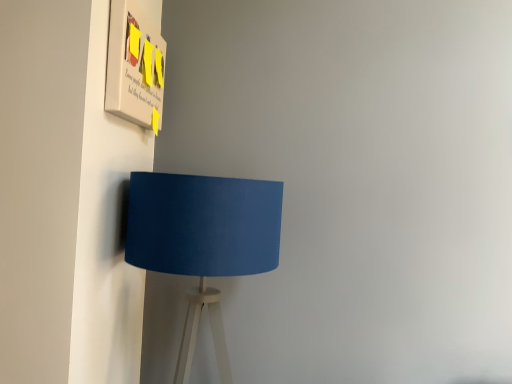
Question: From a real-world perspective, relative to matte blue lampshade at lower left, is matte paper poster at upper left vertically above or below?

Choices:
 (A) above
 (B) below

Answer: (A)

Question: Based on their sizes in the image, would you say matte paper poster at upper left is bigger or smaller than matte blue lampshade at lower left?

Choices:
 (A) big
 (B) small

Answer: (B)

Question: Visually, is matte paper poster at upper left positioned to the left or to the right of matte blue lampshade at lower left?

Choices:
 (A) right
 (B) left

Answer: (B)

Question: Considering their positions, is matte blue lampshade at lower left located in front of or behind matte paper poster at upper left?

Choices:
 (A) behind
 (B) front

Answer: (B)

Question: Does point (128, 256) appear closer or farther from the camera than point (123, 92)?

Choices:
 (A) farther
 (B) closer

Answer: (A)

Question: Is matte blue lampshade at lower left wider or thinner than matte paper poster at upper left?

Choices:
 (A) wide
 (B) thin

Answer: (A)

Question: From a real-world perspective, is matte blue lampshade at lower left positioned above or below matte paper poster at upper left?

Choices:
 (A) below
 (B) above

Answer: (A)